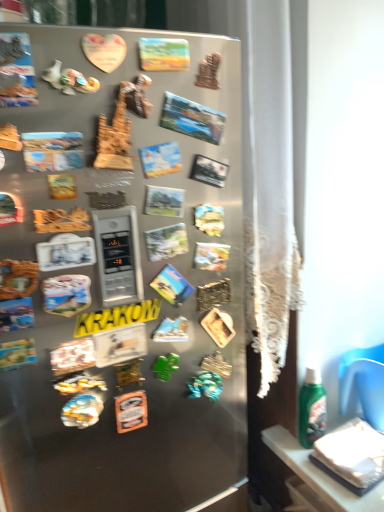
Question: Does matte plastic comic book at upper left, the 4th comic book from the top, touch black matte comic book at center, the fifth comic book positioned from the top?

Choices:
 (A) no
 (B) yes

Answer: (A)

Question: Does matte plastic comic book at upper left, the 4th comic book from the top, appear on the right side of black matte comic book at center, positioned as the fourth comic book in bottom-to-top order?

Choices:
 (A) yes
 (B) no

Answer: (B)

Question: Is matte plastic comic book at upper left, the 4th comic book from the top, facing towards black matte comic book at center, positioned as the fourth comic book in bottom-to-top order?

Choices:
 (A) no
 (B) yes

Answer: (A)

Question: Considering the relative sizes of matte plastic comic book at upper left, the 4th comic book from the top, and black matte comic book at center, the fifth comic book positioned from the top, in the image provided, is matte plastic comic book at upper left, the 4th comic book from the top, bigger than black matte comic book at center, the fifth comic book positioned from the top,?

Choices:
 (A) no
 (B) yes

Answer: (A)

Question: Does matte plastic comic book at upper left, placed as the fifth comic book when sorted from bottom to top, come in front of black matte comic book at center, the fifth comic book positioned from the top?

Choices:
 (A) no
 (B) yes

Answer: (B)

Question: Can you confirm if green plastic magnet at center is thinner than pastel painted canvas at upper center, arranged as the first comic book when viewed from the top?

Choices:
 (A) no
 (B) yes

Answer: (B)

Question: Could pastel painted canvas at upper center, positioned as the 8th comic book in bottom-to-top order, be considered to be inside green plastic magnet at center?

Choices:
 (A) yes
 (B) no

Answer: (B)

Question: Is green plastic magnet at center far away from pastel painted canvas at upper center, arranged as the first comic book when viewed from the top?

Choices:
 (A) no
 (B) yes

Answer: (A)

Question: From the image's perspective, would you say green plastic magnet at center is positioned over pastel painted canvas at upper center, arranged as the first comic book when viewed from the top?

Choices:
 (A) no
 (B) yes

Answer: (A)

Question: Considering the relative sizes of green plastic magnet at center and pastel painted canvas at upper center, positioned as the 8th comic book in bottom-to-top order, in the image provided, is green plastic magnet at center shorter than pastel painted canvas at upper center, positioned as the 8th comic book in bottom-to-top order,?

Choices:
 (A) yes
 (B) no

Answer: (B)

Question: Is green plastic magnet at center smaller than pastel painted canvas at upper center, arranged as the first comic book when viewed from the top?

Choices:
 (A) no
 (B) yes

Answer: (B)

Question: Does satin silver fridge at center touch matte paper comic book at center, marked as the 6th comic book in a top-to-bottom arrangement?

Choices:
 (A) no
 (B) yes

Answer: (A)